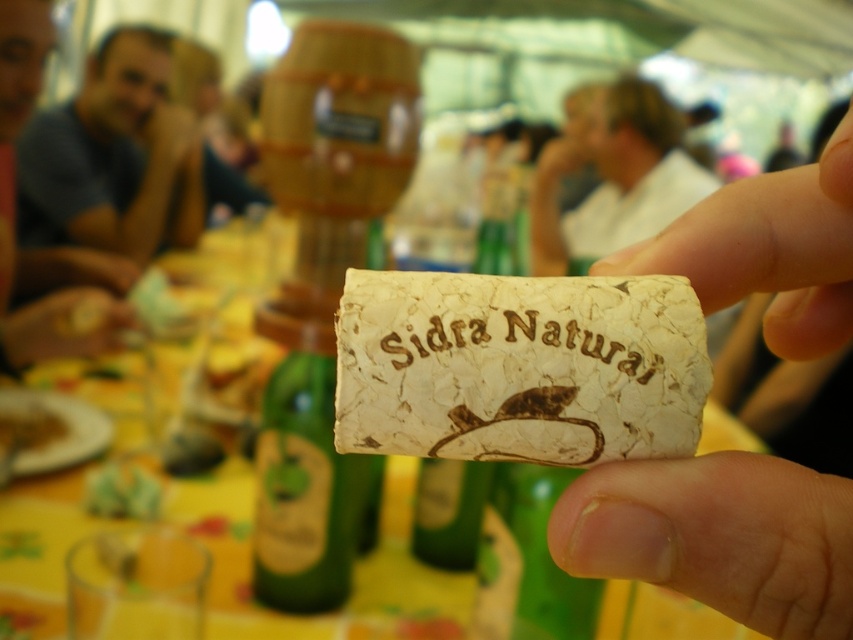
Question: Is the position of green glass bottle at center less distant than that of smooth white hand at upper right?

Choices:
 (A) yes
 (B) no

Answer: (A)

Question: Does blue cotton shirt at upper left have a smaller size compared to green glass bottle at center?

Choices:
 (A) no
 (B) yes

Answer: (A)

Question: Which is farther from the green leafy vegetable at lower left?

Choices:
 (A) smooth white hand at upper right
 (B) cork-like material at center

Answer: (A)

Question: Which point appears farthest from the camera in this image?

Choices:
 (A) (9, 346)
 (B) (126, 509)
 (C) (94, 74)
 (D) (524, 339)

Answer: (C)

Question: Which point is farther to the camera?

Choices:
 (A) (136, 70)
 (B) (3, 276)
 (C) (262, 588)

Answer: (A)

Question: Is smooth yellow lemon at lower left to the right of yellow matte plate at lower left from the viewer's perspective?

Choices:
 (A) yes
 (B) no

Answer: (B)